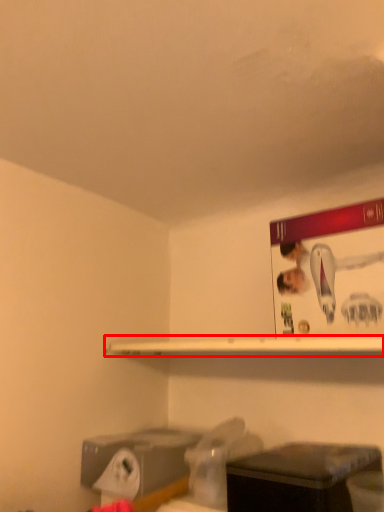
Question: Considering the relative positions of shelf (annotated by the red box) and furniture in the image provided, where is shelf (annotated by the red box) located with respect to the staircase?

Choices:
 (A) right
 (B) left

Answer: (B)